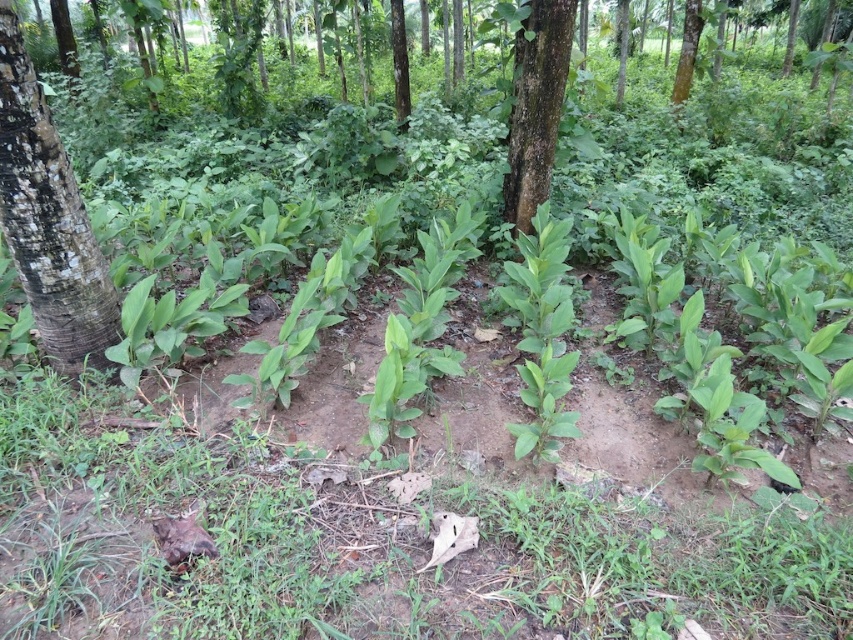
Question: Is rough bark tree trunk at left thinner than smooth brown tree trunk at upper right?

Choices:
 (A) no
 (B) yes

Answer: (A)

Question: Estimate the real-world distances between objects in this image. Which object is closer to the rough bark tree trunk at center?

Choices:
 (A) smooth brown tree trunk at upper right
 (B) rough bark tree trunk at left

Answer: (B)

Question: Is rough bark tree trunk at left below rough bark tree trunk at center?

Choices:
 (A) no
 (B) yes

Answer: (B)

Question: Which object appears farthest from the camera in this image?

Choices:
 (A) rough bark tree trunk at left
 (B) smooth brown tree trunk at upper right
 (C) rough bark tree trunk at center

Answer: (B)

Question: Estimate the real-world distances between objects in this image. Which object is closer to the rough bark tree trunk at center?

Choices:
 (A) smooth brown tree trunk at upper right
 (B) rough bark tree trunk at left

Answer: (B)

Question: Does rough bark tree trunk at left appear on the left side of rough bark tree trunk at center?

Choices:
 (A) yes
 (B) no

Answer: (A)